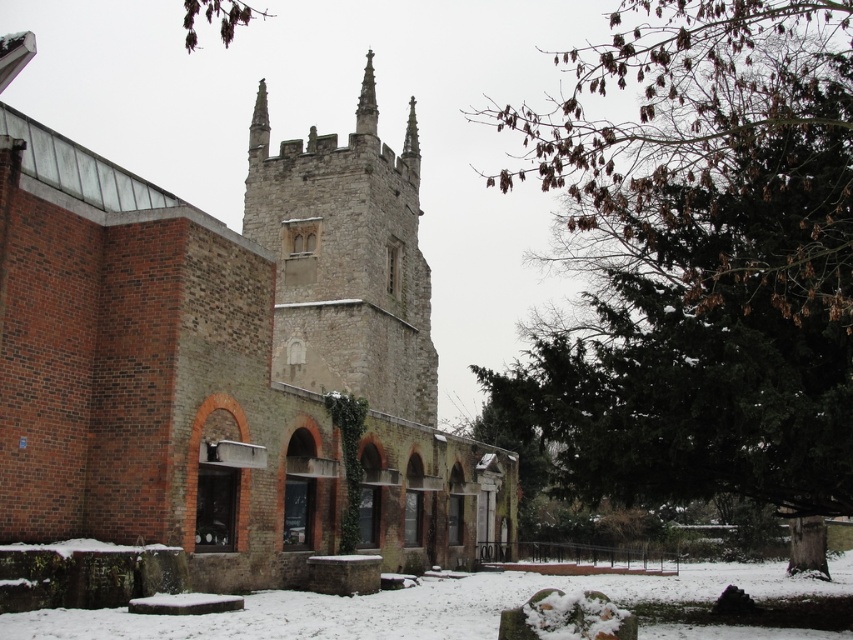
Question: Among these objects, which one is farthest from the camera?

Choices:
 (A) white powdery snow at lower center
 (B) smooth stone spire at center
 (C) gray stone tower at center

Answer: (B)

Question: Does brick church at center come in front of smooth stone spire at center?

Choices:
 (A) no
 (B) yes

Answer: (B)

Question: Estimate the real-world distances between objects in this image. Which object is closer to the brick church at center?

Choices:
 (A) smooth stone spire at center
 (B) white powdery snow at lower center

Answer: (A)

Question: Among these points, which one is nearest to the camera?

Choices:
 (A) (357, 124)
 (B) (361, 170)

Answer: (B)

Question: Is gray stone tower at center smaller than white powdery snow at lower center?

Choices:
 (A) no
 (B) yes

Answer: (B)

Question: From the image, what is the correct spatial relationship of brick church at center in relation to smooth stone spire at center?

Choices:
 (A) above
 (B) below

Answer: (B)